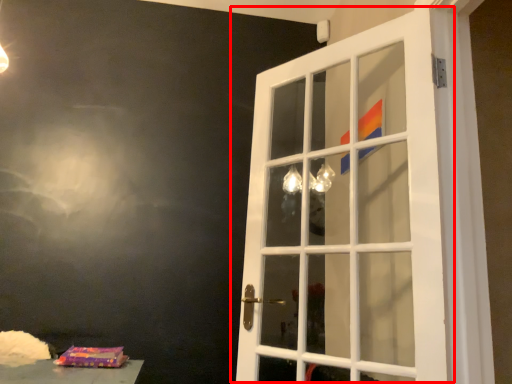
Question: From the image's perspective, considering the relative positions of door (annotated by the red box) and package in the image provided, where is door (annotated by the red box) located with respect to the staircase?

Choices:
 (A) above
 (B) below

Answer: (A)